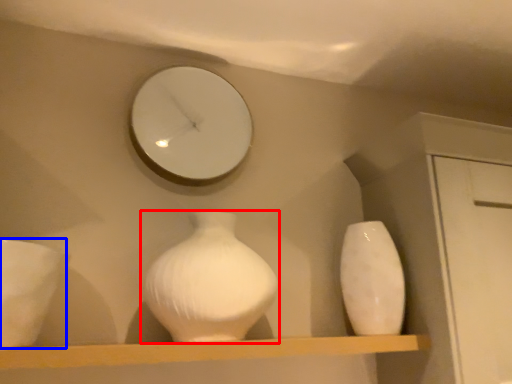
Question: Among these objects, which one is nearest to the camera, vase (highlighted by a red box) or porcelain (highlighted by a blue box)?

Choices:
 (A) vase
 (B) porcelain

Answer: (B)